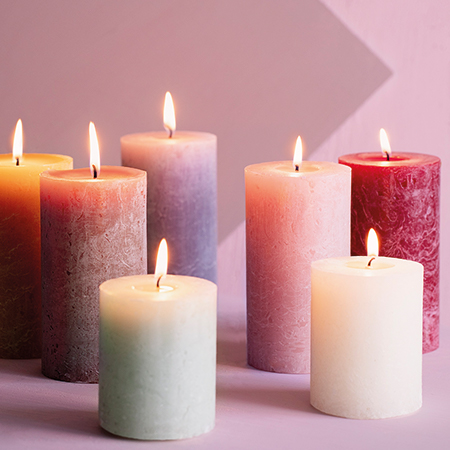
Find the location of a particular element. This screenshot has width=450, height=450. candle is located at coordinates (19, 225), (105, 225), (141, 328), (190, 197), (293, 239), (405, 347), (430, 207).